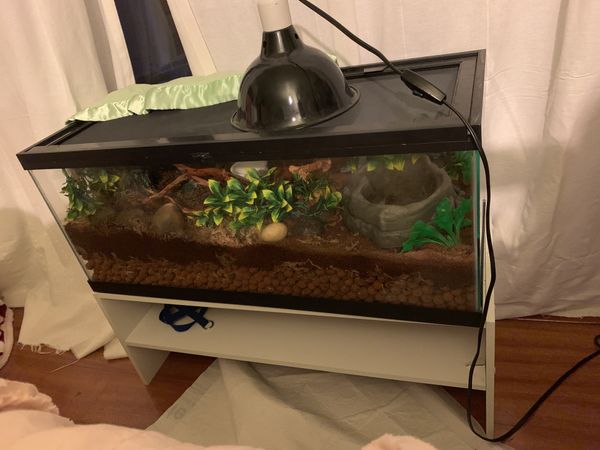
Locate an element on the screen. cord is located at coordinates (468, 392).